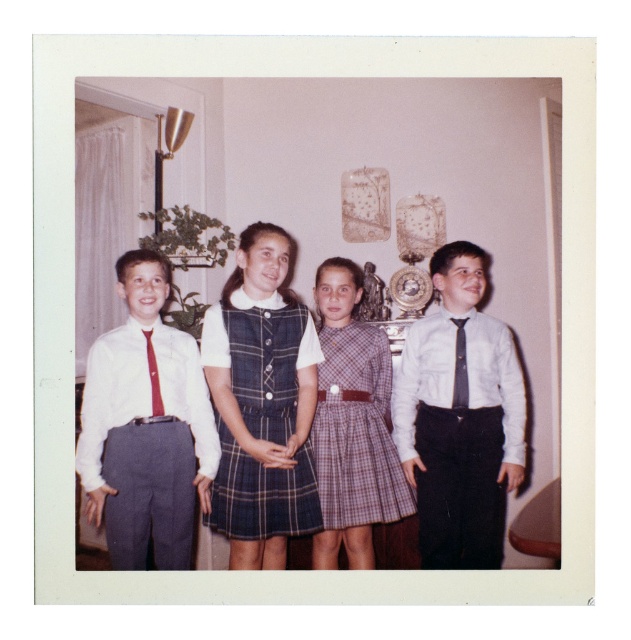
Question: Is matte white shirt at center wider than matte gray pants at left?

Choices:
 (A) yes
 (B) no

Answer: (A)

Question: Based on their relative distances, which object is farther from the plaid wool dress at center?

Choices:
 (A) gray textured tie at right
 (B) red satin tie at left
 (C) plaid fabric dress at center

Answer: (A)

Question: Where is plaid fabric dress at center located in relation to matte gray pants at left in the image?

Choices:
 (A) above
 (B) below

Answer: (B)

Question: Which object is farther from the camera taking this photo?

Choices:
 (A) matte white shirt at center
 (B) gray textured tie at right

Answer: (B)

Question: Does matte white shirt at center lie behind gray textured tie at right?

Choices:
 (A) yes
 (B) no

Answer: (B)

Question: Which point is closer to the camera taking this photo?

Choices:
 (A) (459, 564)
 (B) (463, 397)
 (C) (153, 368)
 (D) (286, 420)

Answer: (D)